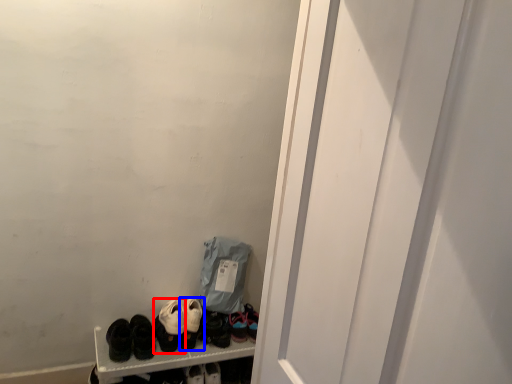
Question: Among these objects, which one is farthest to the camera, footwear (highlighted by a red box) or footwear (highlighted by a blue box)?

Choices:
 (A) footwear
 (B) footwear

Answer: (B)